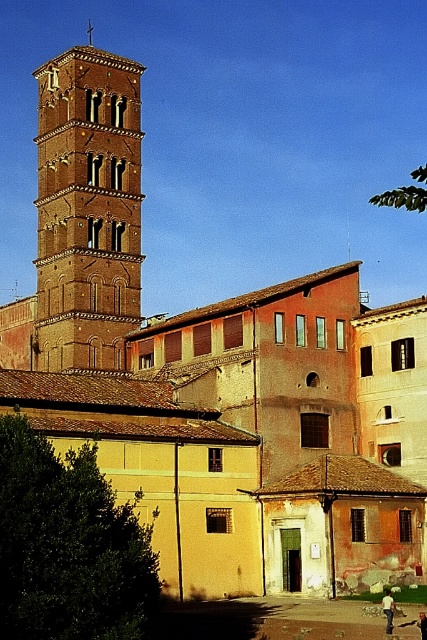
You are a photographer standing in the historic square and want to capture a photo of the bell tower and the person wearing the white cotton shirt at lower right and dark blue jeans at lower right. Where should you position yourself to ensure both the shirt and jeans are fully visible in the frame?

You should position yourself so that you can see the white cotton shirt at lower right below the dark blue jeans at lower right, as the shirt is positioned below the jeans in the scene.

You are a fashion designer observing a historic architectural scene. You notice a white cotton shirt at lower right and dark blue jeans at lower right. Which clothing item appears bigger in the image?

The white cotton shirt at lower right has a larger size compared to dark blue jeans at lower right, so the white cotton shirt at lower right appears bigger in the image.